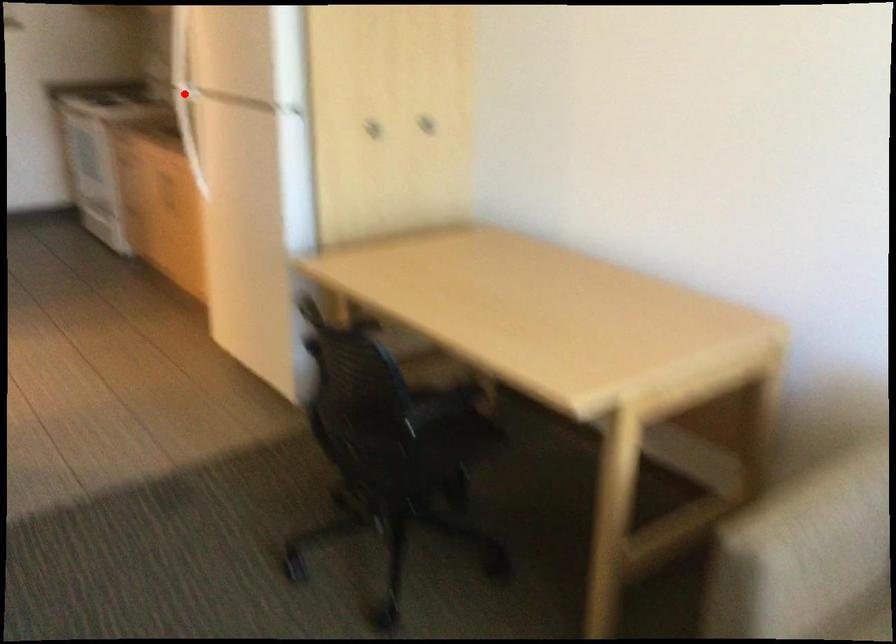
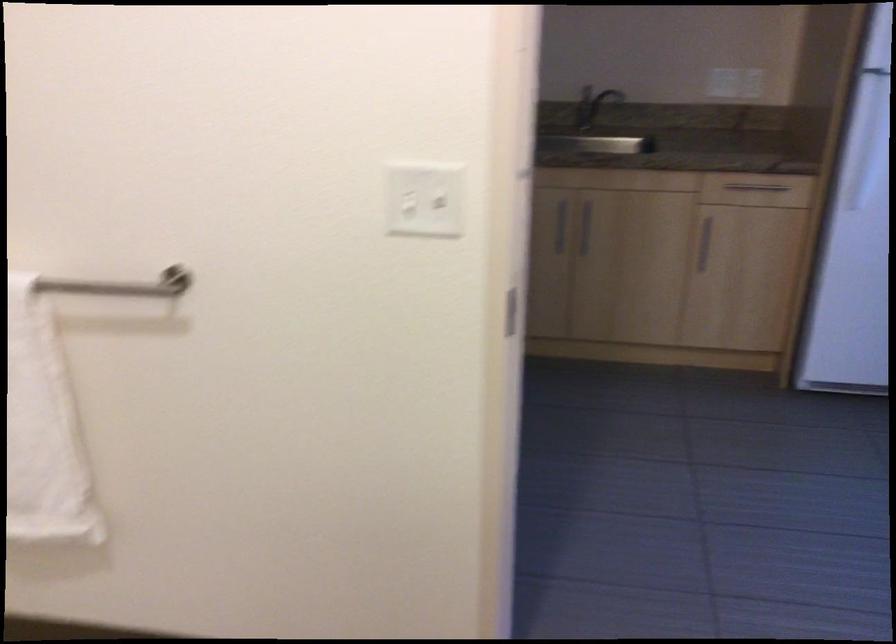
Question: I am providing you with two images of the same scene from different viewpoints. A red point is marked on the first image. Is the red point's position out of view in image 2?

Choices:
 (A) Yes
 (B) No

Answer: (A)